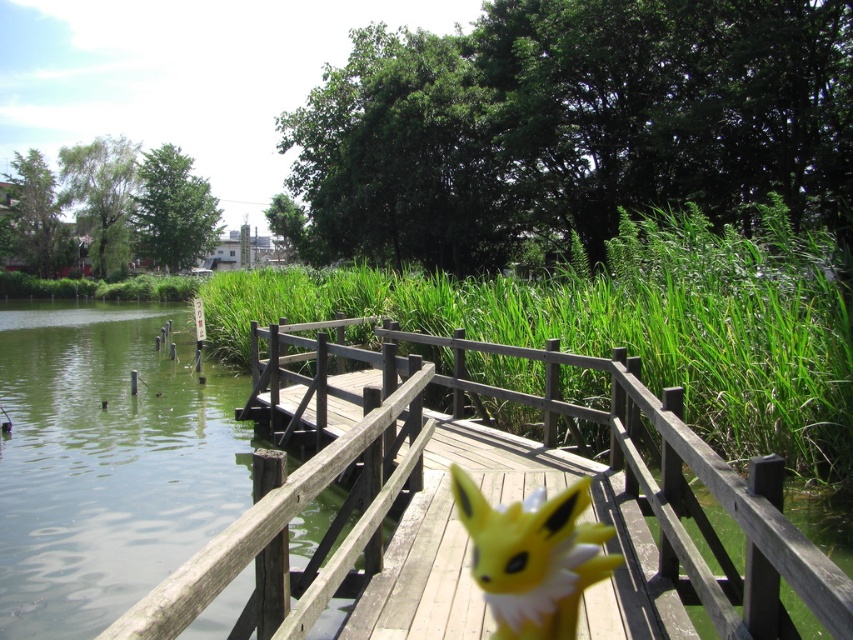
Question: Can you confirm if wooden bridge at center is wider than yellow plush toy at center?

Choices:
 (A) no
 (B) yes

Answer: (A)

Question: Which of the following is the closest to the observer?

Choices:
 (A) yellow plush toy at center
 (B) wooden bridge at center

Answer: (B)

Question: Among these points, which one is farthest from the camera?

Choices:
 (A) (543, 496)
 (B) (587, 616)

Answer: (A)

Question: Where is wooden bridge at center located in relation to yellow plush toy at center in the image?

Choices:
 (A) left
 (B) right

Answer: (B)

Question: Is wooden bridge at center positioned behind yellow plush toy at center?

Choices:
 (A) no
 (B) yes

Answer: (A)